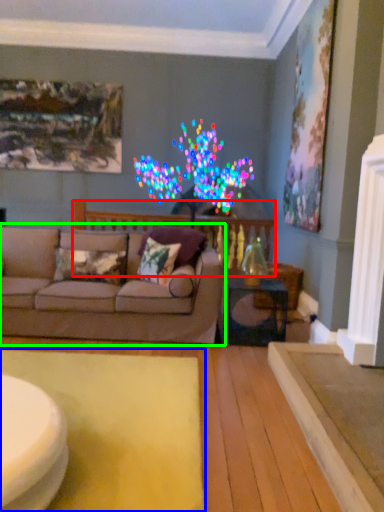
Question: Based on their relative distances, which object is farther from balustrade (highlighted by a red box)? Choose from mat (highlighted by a blue box) and studio couch (highlighted by a green box).

Choices:
 (A) mat
 (B) studio couch

Answer: (A)